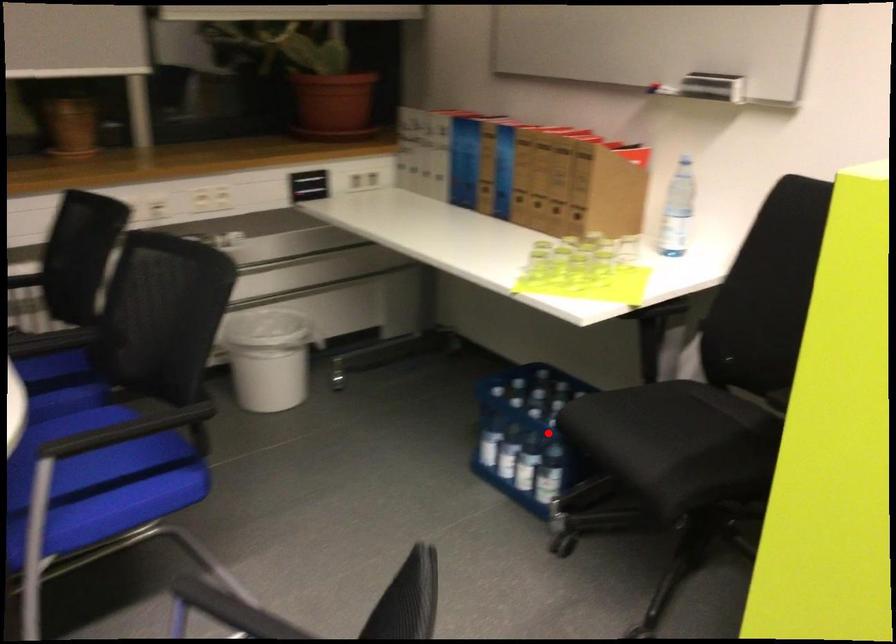
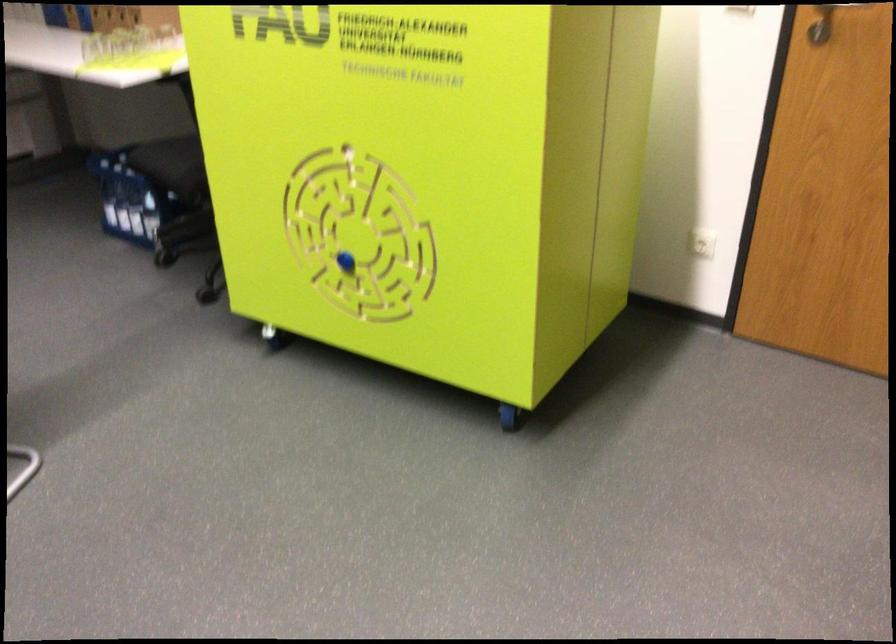
Question: I am providing you with two images of the same scene from different viewpoints. In image1, a red point is highlighted. Considering the same 3D point in image2, which of the following is correct?

Choices:
 (A) It is closer
 (B) It is farther

Answer: (B)